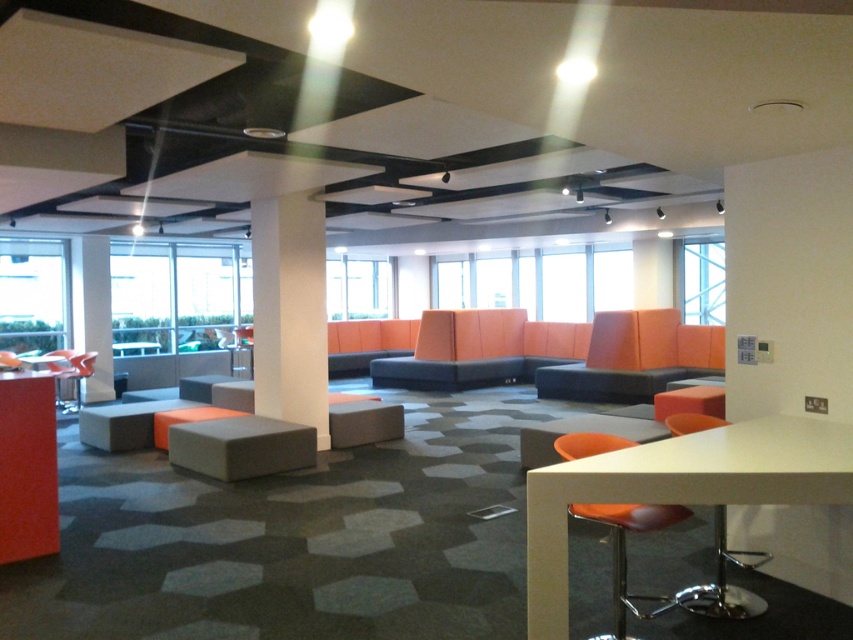
You are an interior designer planning to hang a large painting that requires a 2.5 meter height clearance. Based on the scene, can the white smooth pillar at center and orange fabric couch at center accommodate this requirement?

The white smooth pillar at center is much taller than the orange fabric couch at center. Since the pillar is taller, it likely meets the 2.5 meter height requirement, but the couch is too short. Therefore, the painting should be hung on the pillar.

You are an office worker who wants to move from the entrance to the orange fabric couch at center. There is a white smooth pillar at center in the way. Can you walk around the pillar to reach the couch?

The white smooth pillar at center is to the left of orange fabric couch at center, so you can walk around the right side of the white smooth pillar at center to reach the orange fabric couch at center.

You are a person standing at the entrance of the office and want to sit down. Which stool, the matte gray bar stool at center or the orange fabric stool at lower right, is closer to you?

The matte gray bar stool at center is closer to you because it is further to the viewer than the orange fabric stool at lower right, meaning it is nearer in your line of sight.